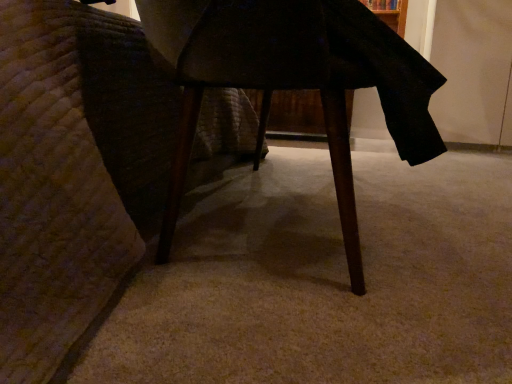
Question: Is wooden table at center taller or shorter than wooden chair leg at lower left?

Choices:
 (A) short
 (B) tall

Answer: (A)

Question: In terms of width, does wooden table at center look wider or thinner when compared to wooden chair leg at lower left?

Choices:
 (A) thin
 (B) wide

Answer: (A)

Question: From the image's perspective, is wooden table at center above or below wooden chair leg at lower left?

Choices:
 (A) below
 (B) above

Answer: (A)

Question: Is point (11, 271) closer or farther from the camera than point (389, 28)?

Choices:
 (A) farther
 (B) closer

Answer: (B)

Question: In the image, is wooden chair leg at lower left positioned in front of or behind wooden table at center?

Choices:
 (A) front
 (B) behind

Answer: (A)

Question: From a real-world perspective, is wooden chair leg at lower left positioned above or below wooden table at center?

Choices:
 (A) above
 (B) below

Answer: (A)

Question: Choose the correct answer: Is wooden chair leg at lower left inside wooden table at center or outside it?

Choices:
 (A) inside
 (B) outside

Answer: (B)